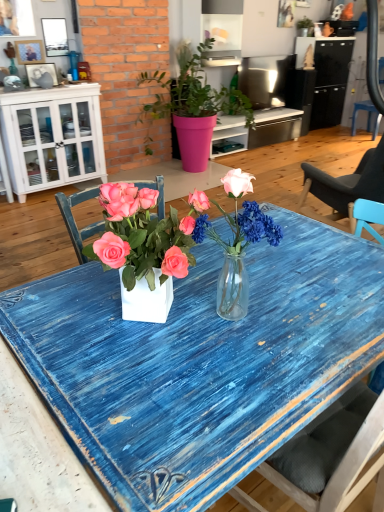
Question: Should I look upward or downward to see green matte plant at upper center, the 2th houseplant from the bottom?

Choices:
 (A) up
 (B) down

Answer: (A)

Question: Is pink matte pot at center, which ranks as the 1th houseplant in front-to-back order, oriented towards blue distressed wood desk at center?

Choices:
 (A) yes
 (B) no

Answer: (B)

Question: Can you confirm if pink matte pot at center, marked as the 1th houseplant in a bottom-to-top arrangement, is smaller than blue distressed wood desk at center?

Choices:
 (A) yes
 (B) no

Answer: (B)

Question: Is pink matte pot at center, positioned as the 2th houseplant in top-to-bottom order, positioned before blue distressed wood desk at center?

Choices:
 (A) yes
 (B) no

Answer: (B)

Question: Is pink matte pot at center, the 2th houseplant when ordered from right to left, in contact with blue distressed wood desk at center?

Choices:
 (A) yes
 (B) no

Answer: (B)

Question: Is pink matte pot at center, which is counted as the 2th houseplant, starting from the back, taller than blue distressed wood desk at center?

Choices:
 (A) no
 (B) yes

Answer: (B)

Question: Does pink matte pot at center, marked as the 1th houseplant in a bottom-to-top arrangement, have a lesser height compared to blue distressed wood desk at center?

Choices:
 (A) no
 (B) yes

Answer: (A)

Question: Is matte black picture frame at upper left, acting as the first picture frame starting from the bottom, wider than pink matte pot at center, marked as the 1th houseplant in a bottom-to-top arrangement?

Choices:
 (A) yes
 (B) no

Answer: (B)

Question: Is matte black picture frame at upper left, acting as the third picture frame starting from the top, shorter than pink matte pot at center, the 2th houseplant when ordered from right to left?

Choices:
 (A) yes
 (B) no

Answer: (A)

Question: Is matte black picture frame at upper left, acting as the third picture frame starting from the top, at the left side of pink matte pot at center, which is counted as the 2th houseplant, starting from the back?

Choices:
 (A) yes
 (B) no

Answer: (A)

Question: Does matte black picture frame at upper left, acting as the first picture frame starting from the bottom, contain pink matte pot at center, the 2th houseplant when ordered from right to left?

Choices:
 (A) yes
 (B) no

Answer: (B)

Question: Considering the relative sizes of matte black picture frame at upper left, acting as the first picture frame starting from the bottom, and pink matte pot at center, the first houseplant positioned from the left, in the image provided, is matte black picture frame at upper left, acting as the first picture frame starting from the bottom, bigger than pink matte pot at center, the first houseplant positioned from the left,?

Choices:
 (A) no
 (B) yes

Answer: (A)

Question: Can you confirm if matte black picture frame at upper left, acting as the first picture frame starting from the bottom, is positioned to the right of pink matte pot at center, which is counted as the 2th houseplant, starting from the back?

Choices:
 (A) no
 (B) yes

Answer: (A)

Question: Is translucent glass vase at center not inside white wood cabinet at left?

Choices:
 (A) yes
 (B) no

Answer: (A)